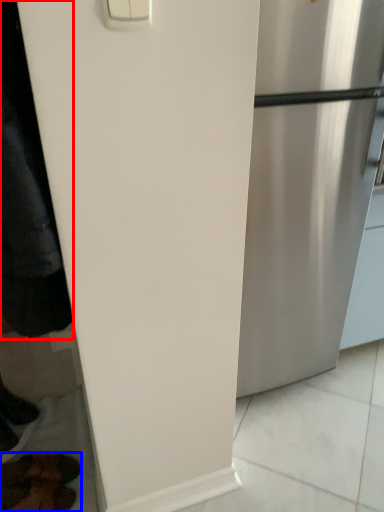
Question: Which object is further to the camera taking this photo, jacket (highlighted by a red box) or footwear (highlighted by a blue box)?

Choices:
 (A) jacket
 (B) footwear

Answer: (B)